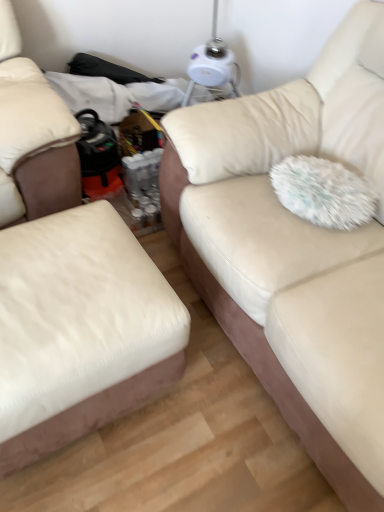
I want to click on beige fabric couch at center, marked as the second studio couch in a left-to-right arrangement, so click(x=295, y=249).

Where is `beige fabric couch at center, placed as the 1th studio couch when sorted from right to left`? beige fabric couch at center, placed as the 1th studio couch when sorted from right to left is located at coordinates (295, 249).

Does white fluffy pillow at right have a lesser width compared to white leather ottoman at left, marked as the second studio couch in a right-to-left arrangement?

Yes, white fluffy pillow at right is thinner than white leather ottoman at left, marked as the second studio couch in a right-to-left arrangement.

Considering the positions of objects white fluffy pillow at right and white leather ottoman at left, marked as the second studio couch in a right-to-left arrangement, in the image provided, who is behind, white fluffy pillow at right or white leather ottoman at left, marked as the second studio couch in a right-to-left arrangement,?

white fluffy pillow at right is further from the camera.

Is beige fabric couch at center, marked as the second studio couch in a left-to-right arrangement, wider or thinner than white plastic table lamp at upper center?

Clearly, beige fabric couch at center, marked as the second studio couch in a left-to-right arrangement, has more width compared to white plastic table lamp at upper center.

Can you confirm if beige fabric couch at center, placed as the 1th studio couch when sorted from right to left, is shorter than white plastic table lamp at upper center?

In fact, beige fabric couch at center, placed as the 1th studio couch when sorted from right to left, may be taller than white plastic table lamp at upper center.

From the image's perspective, is beige fabric couch at center, marked as the second studio couch in a left-to-right arrangement, on top of white plastic table lamp at upper center?

No, from the image's perspective, beige fabric couch at center, marked as the second studio couch in a left-to-right arrangement, is not over white plastic table lamp at upper center.

Who is smaller, beige fabric couch at center, placed as the 1th studio couch when sorted from right to left, or white plastic table lamp at upper center?

Smaller between the two is white plastic table lamp at upper center.

Which of these two, beige fabric couch at center, marked as the second studio couch in a left-to-right arrangement, or white fluffy pillow at right, stands shorter?

Standing shorter between the two is white fluffy pillow at right.

From the image's perspective, is beige fabric couch at center, placed as the 1th studio couch when sorted from right to left, above or below white fluffy pillow at right?

From the image's perspective, beige fabric couch at center, placed as the 1th studio couch when sorted from right to left, appears below white fluffy pillow at right.

Can you confirm if beige fabric couch at center, marked as the second studio couch in a left-to-right arrangement, is thinner than white fluffy pillow at right?

No.

Based on the photo, can you tell me how much beige fabric couch at center, marked as the second studio couch in a left-to-right arrangement, and white fluffy pillow at right differ in facing direction?

0.000202 degrees.

Between white fluffy pillow at right and white plastic table lamp at upper center, which one appears on the left side from the viewer's perspective?

white plastic table lamp at upper center is more to the left.

Between point (321, 219) and point (202, 61), which one is positioned behind?

The point (202, 61) is more distant.

The width and height of the screenshot is (384, 512). In order to click on studio couch on the right of white leather ottoman at left, acting as the first studio couch starting from the left in this screenshot , I will do `click(295, 249)`.

Is white leather ottoman at left, acting as the first studio couch starting from the left, taller or shorter than beige fabric couch at center, placed as the 1th studio couch when sorted from right to left?

Clearly, white leather ottoman at left, acting as the first studio couch starting from the left, is shorter compared to beige fabric couch at center, placed as the 1th studio couch when sorted from right to left.

In the image, is white leather ottoman at left, marked as the second studio couch in a right-to-left arrangement, positioned in front of or behind beige fabric couch at center, placed as the 1th studio couch when sorted from right to left?

In the image, white leather ottoman at left, marked as the second studio couch in a right-to-left arrangement, appears behind beige fabric couch at center, placed as the 1th studio couch when sorted from right to left.

Do you think white leather ottoman at left, acting as the first studio couch starting from the left, is within beige fabric couch at center, marked as the second studio couch in a left-to-right arrangement, or outside of it?

white leather ottoman at left, acting as the first studio couch starting from the left, lies outside beige fabric couch at center, marked as the second studio couch in a left-to-right arrangement.

Looking at the image, does beige fabric couch at center, marked as the second studio couch in a left-to-right arrangement, seem bigger or smaller compared to white leather ottoman at left, marked as the second studio couch in a right-to-left arrangement?

Considering their sizes, beige fabric couch at center, marked as the second studio couch in a left-to-right arrangement, takes up more space than white leather ottoman at left, marked as the second studio couch in a right-to-left arrangement.

Considering the relative sizes of beige fabric couch at center, placed as the 1th studio couch when sorted from right to left, and white leather ottoman at left, marked as the second studio couch in a right-to-left arrangement, in the image provided, is beige fabric couch at center, placed as the 1th studio couch when sorted from right to left, shorter than white leather ottoman at left, marked as the second studio couch in a right-to-left arrangement,?

In fact, beige fabric couch at center, placed as the 1th studio couch when sorted from right to left, may be taller than white leather ottoman at left, marked as the second studio couch in a right-to-left arrangement.

How different are the orientations of beige fabric couch at center, placed as the 1th studio couch when sorted from right to left, and white leather ottoman at left, marked as the second studio couch in a right-to-left arrangement, in degrees?

The angle between the facing direction of beige fabric couch at center, placed as the 1th studio couch when sorted from right to left, and the facing direction of white leather ottoman at left, marked as the second studio couch in a right-to-left arrangement, is 93.1 degrees.

Is beige fabric couch at center, marked as the second studio couch in a left-to-right arrangement, not near white leather ottoman at left, acting as the first studio couch starting from the left?

That's not correct — beige fabric couch at center, marked as the second studio couch in a left-to-right arrangement, is a little close to white leather ottoman at left, acting as the first studio couch starting from the left.

Which is more to the left, white plastic table lamp at upper center or white fluffy pillow at right?

Positioned to the left is white plastic table lamp at upper center.

Which is closer to the camera, [192,58] or [293,170]?

Point [192,58] is positioned farther from the camera compared to point [293,170].

Is white plastic table lamp at upper center bigger than white fluffy pillow at right?

Indeed, white plastic table lamp at upper center has a larger size compared to white fluffy pillow at right.

From a real-world perspective, is white plastic table lamp at upper center positioned over white fluffy pillow at right based on gravity?

No, from a real-world perspective, white plastic table lamp at upper center is not on top of white fluffy pillow at right.

You are a GUI agent. You are given a task and a screenshot of the screen. Output one action in this format:
    pyautogui.click(x=<x>, y=<y>)
    Task: Click on the throw pillow that appears above the white leather ottoman at left, acting as the first studio couch starting from the left (from a real-world perspective)
    
    Given the screenshot: What is the action you would take?
    pyautogui.click(x=324, y=192)

Find the location of a particular element. The height and width of the screenshot is (512, 384). studio couch on the right side of white plastic table lamp at upper center is located at coordinates (295, 249).

Estimate the real-world distances between objects in this image. Which object is further from white plastic table lamp at upper center, white fluffy pillow at right or white leather ottoman at left, acting as the first studio couch starting from the left?

white leather ottoman at left, acting as the first studio couch starting from the left.

From the picture: Based on their spatial positions, is white fluffy pillow at right or beige fabric couch at center, marked as the second studio couch in a left-to-right arrangement, closer to white leather ottoman at left, acting as the first studio couch starting from the left?

beige fabric couch at center, marked as the second studio couch in a left-to-right arrangement, is positioned closer to the anchor white leather ottoman at left, acting as the first studio couch starting from the left.

When comparing their distances from beige fabric couch at center, placed as the 1th studio couch when sorted from right to left, does white fluffy pillow at right or white plastic table lamp at upper center seem closer?

white fluffy pillow at right is closer to beige fabric couch at center, placed as the 1th studio couch when sorted from right to left.

Looking at the image, which one is located further to white fluffy pillow at right, beige fabric couch at center, marked as the second studio couch in a left-to-right arrangement, or white plastic table lamp at upper center?

Based on the image, white plastic table lamp at upper center appears to be further to white fluffy pillow at right.

Based on their spatial positions, is white leather ottoman at left, acting as the first studio couch starting from the left, or white plastic table lamp at upper center closer to white fluffy pillow at right?

The object closer to white fluffy pillow at right is white leather ottoman at left, acting as the first studio couch starting from the left.

Estimate the real-world distances between objects in this image. Which object is closer to beige fabric couch at center, placed as the 1th studio couch when sorted from right to left, white plastic table lamp at upper center or white fluffy pillow at right?

white fluffy pillow at right is closer to beige fabric couch at center, placed as the 1th studio couch when sorted from right to left.

When comparing their distances from white plastic table lamp at upper center, does beige fabric couch at center, placed as the 1th studio couch when sorted from right to left, or white leather ottoman at left, acting as the first studio couch starting from the left, seem further?

white leather ottoman at left, acting as the first studio couch starting from the left, is further to white plastic table lamp at upper center.

Consider the image. From the image, which object appears to be nearer to white plastic table lamp at upper center, white fluffy pillow at right or beige fabric couch at center, marked as the second studio couch in a left-to-right arrangement?

Based on the image, white fluffy pillow at right appears to be nearer to white plastic table lamp at upper center.

Find the location of a particular element. Image resolution: width=384 pixels, height=512 pixels. throw pillow between white plastic table lamp at upper center and white leather ottoman at left, acting as the first studio couch starting from the left, in the up-down direction is located at coordinates (324, 192).

The width and height of the screenshot is (384, 512). Identify the location of studio couch between beige fabric couch at center, marked as the second studio couch in a left-to-right arrangement, and white plastic table lamp at upper center, along the z-axis. (79, 329).

This screenshot has height=512, width=384. What are the coordinates of `throw pillow between beige fabric couch at center, placed as the 1th studio couch when sorted from right to left, and white plastic table lamp at upper center in the front-back direction` in the screenshot? It's located at (324, 192).

You are a GUI agent. You are given a task and a screenshot of the screen. Output one action in this format:
    pyautogui.click(x=<x>, y=<y>)
    Task: Click on the throw pillow located between white leather ottoman at left, acting as the first studio couch starting from the left, and beige fabric couch at center, placed as the 1th studio couch when sorted from right to left, in the left-right direction
    
    Given the screenshot: What is the action you would take?
    pyautogui.click(x=324, y=192)